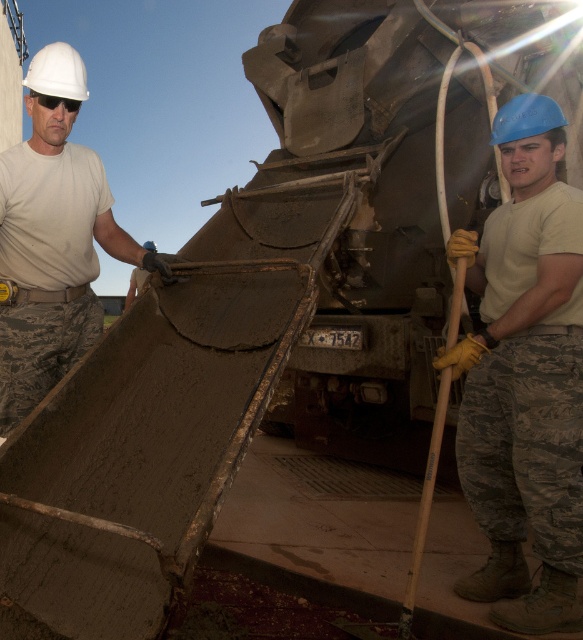
Can you confirm if blue hard hat at upper right is wider than matte white helmet at upper left?

No.

Measure the distance between blue hard hat at upper right and camera.

A distance of 7.54 feet exists between blue hard hat at upper right and camera.

You are a GUI agent. You are given a task and a screenshot of the screen. Output one action in this format:
    pyautogui.click(x=<x>, y=<y>)
    Task: Click on the blue hard hat at upper right
    This screenshot has height=640, width=583.
    Given the screenshot: What is the action you would take?
    pyautogui.click(x=525, y=378)